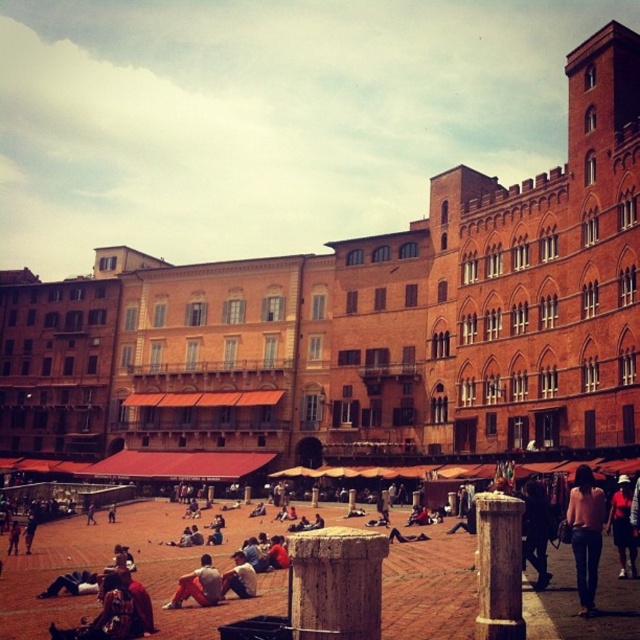
You are a tailor who needs to determine which pair of pants to alter first. You have a denim jeans at lower right and an orange cotton pants at lower left in front of you. Based on their widths, which one requires more fabric to adjust?

The denim jeans at lower right requires more fabric to adjust since its width is greater than the orange cotton pants at lower left.

You are a photographer standing in the square and want to take a photo that includes both the black leather jacket at lower right and the light brown leather jacket at center. Which jacket should you position closer to the front of the frame to ensure both are fully visible?

The black leather jacket at lower right is much taller than the light brown leather jacket at center. To ensure both are fully visible in the photo, position the black leather jacket at lower right closer to the front of the frame so its full height can be captured without cropping.